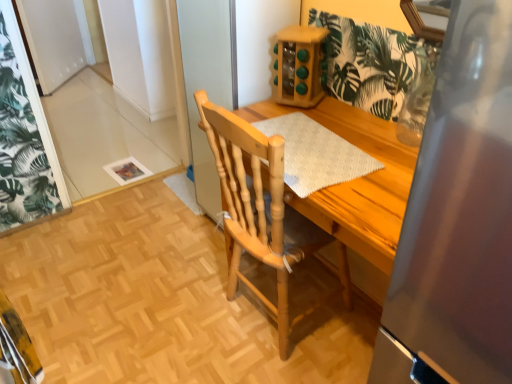
Question: From the image's perspective, is white textured placemat at center positioned above or below natural wood chair at center?

Choices:
 (A) below
 (B) above

Answer: (B)

Question: Relative to natural wood chair at center, is white textured placemat at center in front or behind?

Choices:
 (A) behind
 (B) front

Answer: (A)

Question: Is white textured placemat at center wider or thinner than natural wood chair at center?

Choices:
 (A) wide
 (B) thin

Answer: (B)

Question: Considering the positions of natural wood chair at center and white textured placemat at center in the image, is natural wood chair at center wider or thinner than white textured placemat at center?

Choices:
 (A) thin
 (B) wide

Answer: (B)

Question: From the image's perspective, is natural wood chair at center located above or below white textured placemat at center?

Choices:
 (A) above
 (B) below

Answer: (B)

Question: In the image, is natural wood chair at center on the left side or the right side of white textured placemat at center?

Choices:
 (A) right
 (B) left

Answer: (B)

Question: Is natural wood chair at center situated inside white textured placemat at center or outside?

Choices:
 (A) inside
 (B) outside

Answer: (B)